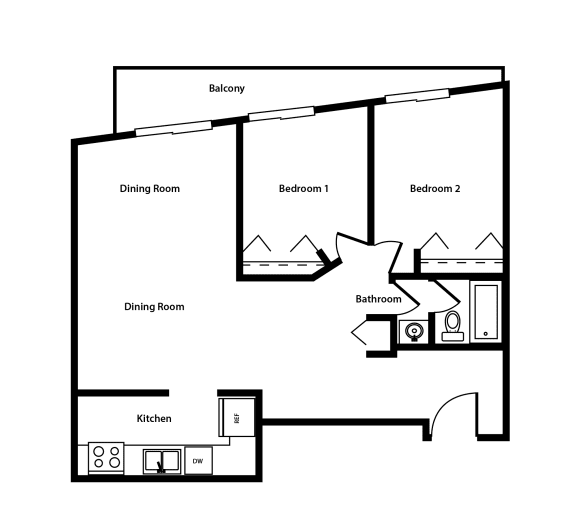
You are a GUI agent. You are given a task and a screenshot of the screen. Output one action in this format:
    pyautogui.click(x=<x>, y=<y>)
    Task: Click on the kitchen
    Image resolution: width=576 pixels, height=518 pixels.
    Given the screenshot: What is the action you would take?
    coord(185,426)